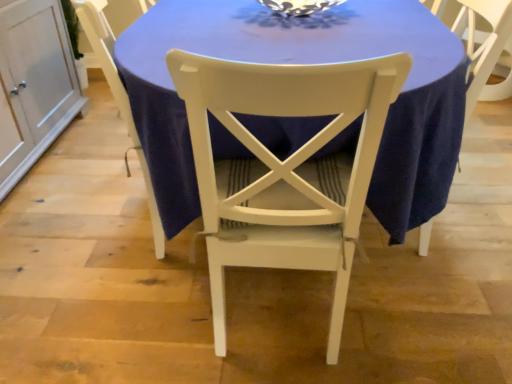
Describe the element at coordinates (33, 84) in the screenshot. The image size is (512, 384). I see `white wood cabinet at left` at that location.

What is the approximate height of blue fabric table at center?

33.41 inches.

The image size is (512, 384). What do you see at coordinates (118, 96) in the screenshot?
I see `white painted wood chair at center, which is the first chair in left-to-right order` at bounding box center [118, 96].

Locate an element on the screen. white wood cabinet at left is located at coordinates (33, 84).

Who is more distant, white painted wood chair at center, arranged as the second chair when viewed from the left, or blue fabric table at center?

blue fabric table at center is behind.

Which of these two, white painted wood chair at center, arranged as the second chair when viewed from the left, or blue fabric table at center, stands taller?

Standing taller between the two is white painted wood chair at center, arranged as the second chair when viewed from the left.

Does white painted wood chair at center, positioned as the 1th chair in right-to-left order, contain blue fabric table at center?

No, white painted wood chair at center, positioned as the 1th chair in right-to-left order, does not contain blue fabric table at center.

Considering the relative sizes of white painted wood chair at center, arranged as the second chair when viewed from the left, and blue fabric table at center in the image provided, is white painted wood chair at center, arranged as the second chair when viewed from the left, bigger than blue fabric table at center?

Incorrect, white painted wood chair at center, arranged as the second chair when viewed from the left, is not larger than blue fabric table at center.

Is blue fabric table at center directly adjacent to white painted wood chair at center, arranged as the second chair when viewed from the left?

blue fabric table at center and white painted wood chair at center, arranged as the second chair when viewed from the left, are clearly separated.

Consider the image. Is white painted wood chair at center, arranged as the second chair when viewed from the left, at the back of blue fabric table at center?

That's not correct — blue fabric table at center is not looking away from white painted wood chair at center, arranged as the second chair when viewed from the left.

From the image's perspective, is blue fabric table at center on top of white painted wood chair at center, arranged as the second chair when viewed from the left?

Yes.

Is point (181, 5) behind point (345, 301)?

Yes, it is behind point (345, 301).

Is white wood cabinet at left not close to white painted wood chair at center, acting as the 2th chair starting from the right?

That's not correct — white wood cabinet at left is a little close to white painted wood chair at center, acting as the 2th chair starting from the right.

Is white wood cabinet at left spatially inside white painted wood chair at center, acting as the 2th chair starting from the right, or outside of it?

white wood cabinet at left cannot be found inside white painted wood chair at center, acting as the 2th chair starting from the right.

Where is `cabinetry lying above the white painted wood chair at center, acting as the 2th chair starting from the right (from the image's perspective)`? This screenshot has width=512, height=384. cabinetry lying above the white painted wood chair at center, acting as the 2th chair starting from the right (from the image's perspective) is located at coordinates (33, 84).

Is white painted wood chair at center, acting as the 2th chair starting from the right, located outside white painted wood chair at center, arranged as the second chair when viewed from the left?

Indeed, white painted wood chair at center, acting as the 2th chair starting from the right, is completely outside white painted wood chair at center, arranged as the second chair when viewed from the left.

Is point (103, 39) positioned behind point (228, 173)?

No, it is not.

From the image's perspective, is white painted wood chair at center, which is the first chair in left-to-right order, positioned above or below white painted wood chair at center, arranged as the second chair when viewed from the left?

white painted wood chair at center, which is the first chair in left-to-right order, is above white painted wood chair at center, arranged as the second chair when viewed from the left.

Measure the distance from white painted wood chair at center, which is the first chair in left-to-right order, to white painted wood chair at center, arranged as the second chair when viewed from the left.

white painted wood chair at center, which is the first chair in left-to-right order, is 19.17 inches away from white painted wood chair at center, arranged as the second chair when viewed from the left.

Does white wood cabinet at left have a lesser width compared to blue fabric table at center?

Correct, the width of white wood cabinet at left is less than that of blue fabric table at center.

Between white wood cabinet at left and blue fabric table at center, which one has more height?

Standing taller between the two is blue fabric table at center.

Would you say blue fabric table at center is part of white wood cabinet at left's contents?

No.

This screenshot has width=512, height=384. What are the coordinates of `table in front of the white wood cabinet at left` in the screenshot? It's located at (303, 63).

Does blue fabric table at center turn towards white painted wood chair at center, acting as the 2th chair starting from the right?

No, blue fabric table at center is not turned towards white painted wood chair at center, acting as the 2th chair starting from the right.

Is blue fabric table at center to the left or to the right of white painted wood chair at center, acting as the 2th chair starting from the right, in the image?

In the image, blue fabric table at center appears on the right side of white painted wood chair at center, acting as the 2th chair starting from the right.

I want to click on cabinetry behind the white painted wood chair at center, arranged as the second chair when viewed from the left, so click(33, 84).

Considering the positions of point (350, 122) and point (22, 31), is point (350, 122) closer or farther from the camera than point (22, 31)?

Point (350, 122) is positioned closer to the camera compared to point (22, 31).

Considering the sizes of objects white painted wood chair at center, positioned as the 1th chair in right-to-left order, and white wood cabinet at left in the image provided, who is taller, white painted wood chair at center, positioned as the 1th chair in right-to-left order, or white wood cabinet at left?

Standing taller between the two is white painted wood chair at center, positioned as the 1th chair in right-to-left order.

Between white painted wood chair at center, positioned as the 1th chair in right-to-left order, and white wood cabinet at left, which one has smaller size?

white painted wood chair at center, positioned as the 1th chair in right-to-left order.

Where is `table behind the white painted wood chair at center, positioned as the 1th chair in right-to-left order`? table behind the white painted wood chair at center, positioned as the 1th chair in right-to-left order is located at coordinates (303, 63).

Where is `chair that is the 1st one when counting leftward from the blue fabric table at center`? This screenshot has height=384, width=512. chair that is the 1st one when counting leftward from the blue fabric table at center is located at coordinates (285, 167).

Looking at the image, which one is located closer to white wood cabinet at left, blue fabric table at center or white painted wood chair at center, positioned as the 1th chair in right-to-left order?

Based on the image, blue fabric table at center appears to be nearer to white wood cabinet at left.

Based on their spatial positions, is white wood cabinet at left or white painted wood chair at center, which is the first chair in left-to-right order, further from white painted wood chair at center, positioned as the 1th chair in right-to-left order?

white wood cabinet at left lies further to white painted wood chair at center, positioned as the 1th chair in right-to-left order, than the other object.

Which object lies further to the anchor point white painted wood chair at center, positioned as the 1th chair in right-to-left order, white wood cabinet at left or blue fabric table at center?

white wood cabinet at left is further to white painted wood chair at center, positioned as the 1th chair in right-to-left order.

Looking at the image, which one is located further to white painted wood chair at center, which is the first chair in left-to-right order, blue fabric table at center or white wood cabinet at left?

white wood cabinet at left.

Based on their spatial positions, is white painted wood chair at center, arranged as the second chair when viewed from the left, or blue fabric table at center closer to white wood cabinet at left?

blue fabric table at center lies closer to white wood cabinet at left than the other object.

When comparing their distances from white wood cabinet at left, does white painted wood chair at center, which is the first chair in left-to-right order, or blue fabric table at center seem further?

blue fabric table at center is further to white wood cabinet at left.

Estimate the real-world distances between objects in this image. Which object is closer to white painted wood chair at center, positioned as the 1th chair in right-to-left order, white painted wood chair at center, acting as the 2th chair starting from the right, or white wood cabinet at left?

Among the two, white painted wood chair at center, acting as the 2th chair starting from the right, is located nearer to white painted wood chair at center, positioned as the 1th chair in right-to-left order.

Considering their positions, is white painted wood chair at center, positioned as the 1th chair in right-to-left order, positioned further to white painted wood chair at center, which is the first chair in left-to-right order, than blue fabric table at center?

The object further to white painted wood chair at center, which is the first chair in left-to-right order, is white painted wood chair at center, positioned as the 1th chair in right-to-left order.

Where is `chair between white painted wood chair at center, which is the first chair in left-to-right order, and blue fabric table at center, in the horizontal direction`? The width and height of the screenshot is (512, 384). chair between white painted wood chair at center, which is the first chair in left-to-right order, and blue fabric table at center, in the horizontal direction is located at coordinates (285, 167).

The image size is (512, 384). What are the coordinates of `chair between white wood cabinet at left and white painted wood chair at center, arranged as the second chair when viewed from the left, from left to right` in the screenshot? It's located at (118, 96).